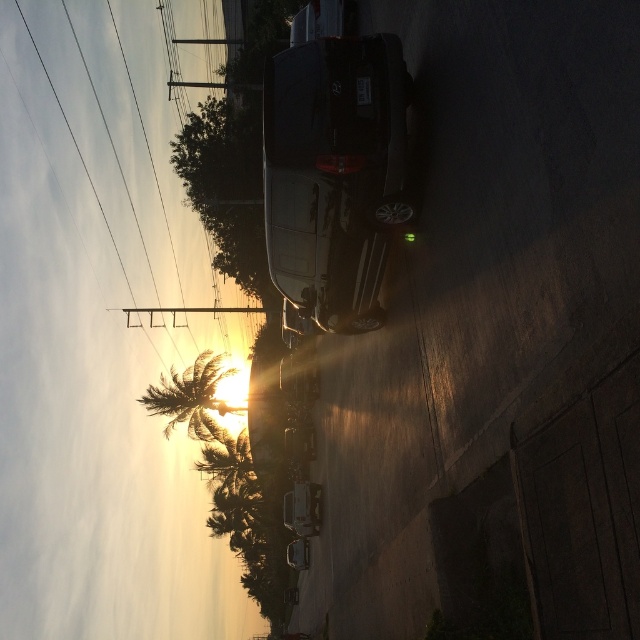
You are a delivery person who needs to park your 3.5 meter long van between the green leafy palm tree at lower left and the green leafy palm tree at lower center. Is there enough space between them to park your van?

The distance between the green leafy palm tree at lower left and the green leafy palm tree at lower center is 5.48 meters. Since your van is 3.5 meters long, there is sufficient space to park it between them.

You are a pedestrian standing at the edge of the road. You need to cross the street to reach a bench on the opposite side. There is a satin black suv at center and a green leafy palm tree at lower center in your view. Which object should you avoid stepping on while crossing?

You should avoid stepping on the satin black suv at center because it is a vehicle and located on the road, while the green leafy palm tree at lower center is likely on the side of the street and safe to walk around.